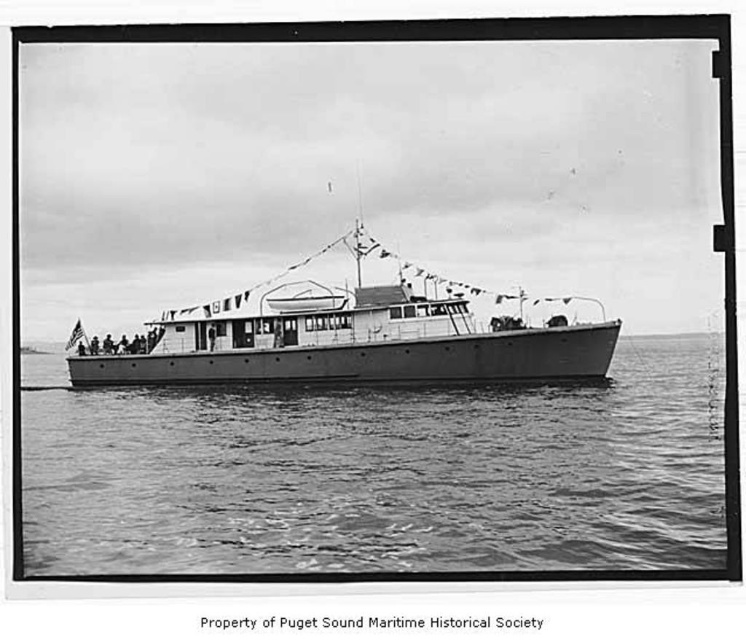
You are a photographer taking a picture of the smooth metal boat at center and the smooth water at center. Which object is closer to the camera lens when focusing on both?

The smooth water at center is closer to the viewer than the smooth metal boat at center, so the water would be in focus if focusing on both.

You are a photographer planning to capture the smooth metal boat at center and the smooth water at center in a single frame. Given that your camera can only focus on objects within a 10 meter width, can both objects fit in the frame if their combined width is less than 10 meters?

The smooth water at center is wider than the smooth metal boat at center. Since their combined width must be less than 10 meters to fit in the frame, but we donot know the exact widths, it is impossible to determine without additional information.